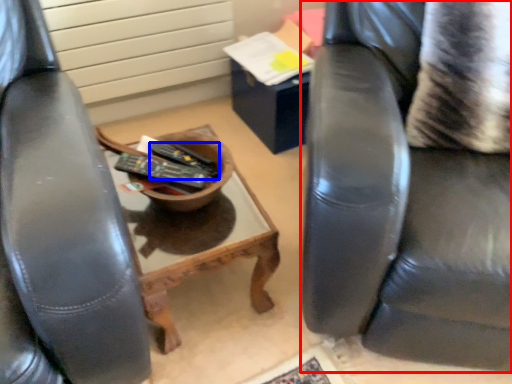
Question: Which object appears farthest to the camera in this image, chair (highlighted by a red box) or remote control (highlighted by a blue box)?

Choices:
 (A) chair
 (B) remote control

Answer: (B)